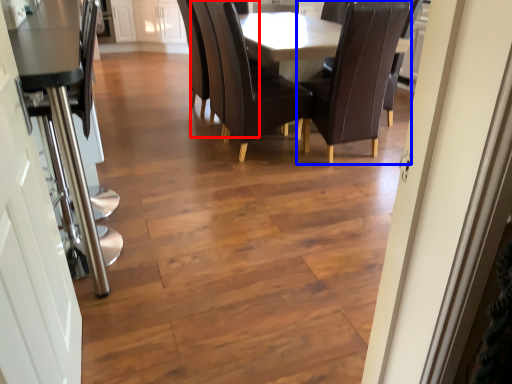
Question: Which object is further to the camera taking this photo, armchair (highlighted by a red box) or chair (highlighted by a blue box)?

Choices:
 (A) armchair
 (B) chair

Answer: (A)